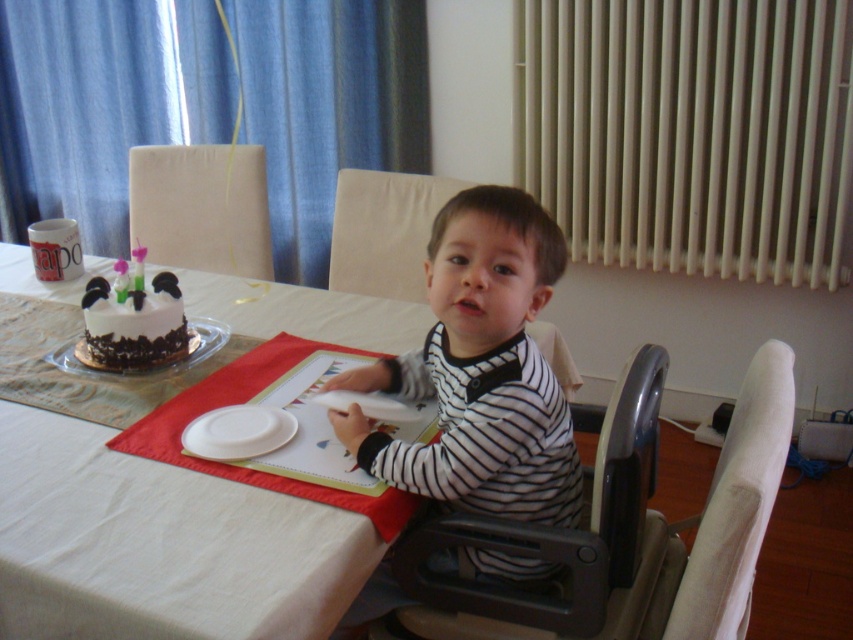
Question: Based on their relative distances, which object is farther from the white cloth table at center?

Choices:
 (A) white frosted cake at left
 (B) striped fabric shirt at center
 (C) black plastic highchair at center
 (D) beige fabric chair at upper left

Answer: (D)

Question: Is white cloth table at center to the left of white matte plate at lower center from the viewer's perspective?

Choices:
 (A) no
 (B) yes

Answer: (B)

Question: Does striped fabric shirt at center appear on the left side of black plastic highchair at center?

Choices:
 (A) no
 (B) yes

Answer: (B)

Question: Is the position of striped fabric shirt at center less distant than that of beige fabric chair at upper left?

Choices:
 (A) no
 (B) yes

Answer: (B)

Question: Which object is farther from the camera taking this photo?

Choices:
 (A) striped fabric shirt at center
 (B) white frosted cake at left
 (C) white cloth table at center
 (D) beige fabric chair at upper left

Answer: (D)

Question: Which point is closer to the camera?

Choices:
 (A) beige fabric chair at upper left
 (B) black plastic highchair at center

Answer: (B)